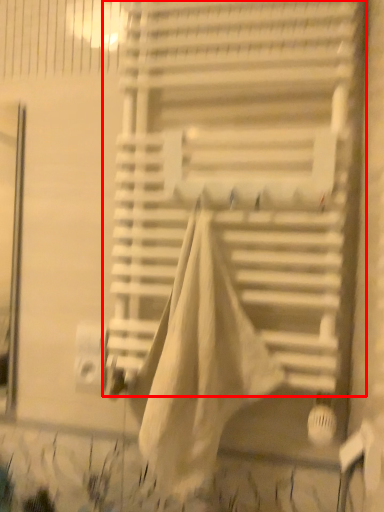
Question: From the image's perspective, where is window blind (annotated by the red box) located in relation to blanket in the image?

Choices:
 (A) above
 (B) below

Answer: (A)